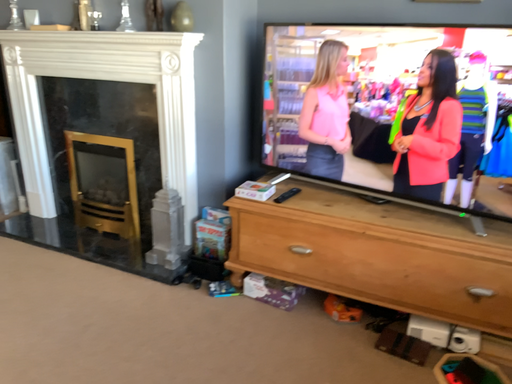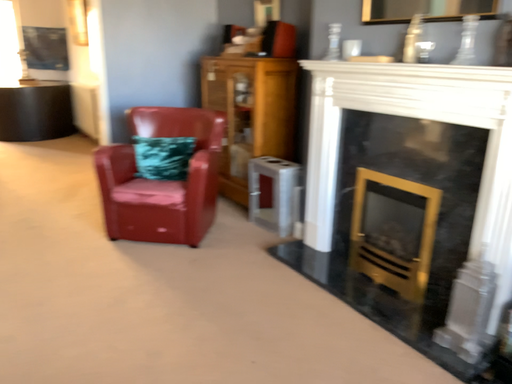
Question: Which way did the camera rotate in the video?

Choices:
 (A) rotated upward
 (B) rotated downward

Answer: (A)